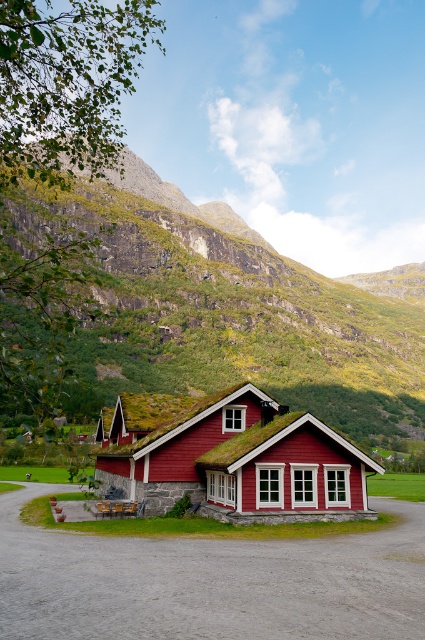
Which is below, green moss-covered hillside at upper center or matte red wooden cottage at center?

matte red wooden cottage at center

Does green moss-covered hillside at upper center appear over matte red wooden cottage at center?

Yes, green moss-covered hillside at upper center is above matte red wooden cottage at center.

Between point (320, 406) and point (257, 406), which one is positioned behind?

Positioned behind is point (320, 406).

The height and width of the screenshot is (640, 425). In order to click on green moss-covered hillside at upper center in this screenshot , I will do `click(227, 307)`.